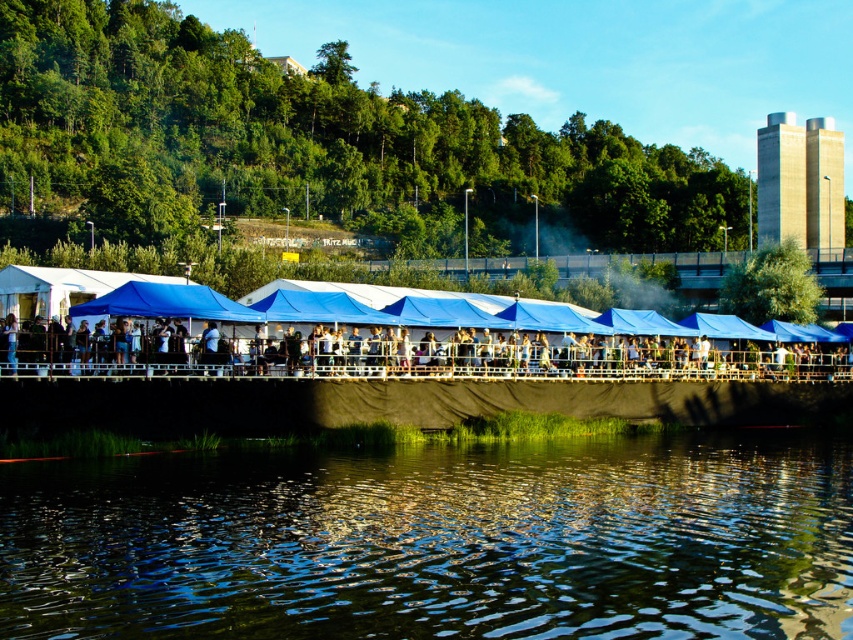
Can you confirm if green reflective water at lower center is shorter than blue fabric canopy at center?

Correct, green reflective water at lower center is not as tall as blue fabric canopy at center.

Who is shorter, green reflective water at lower center or blue fabric canopy at center?

Standing shorter between the two is green reflective water at lower center.

Does point (142, 556) come behind point (198, 307)?

No.

Where is `green reflective water at lower center`? green reflective water at lower center is located at coordinates (438, 540).

Where is `green reflective water at lower center`? The width and height of the screenshot is (853, 640). green reflective water at lower center is located at coordinates (438, 540).

Find the location of `green reflective water at lower center`. green reflective water at lower center is located at coordinates (438, 540).

Locate an element on the screen. green reflective water at lower center is located at coordinates (438, 540).

Is point (122, 326) farther from camera compared to point (141, 282)?

No, it is not.

The width and height of the screenshot is (853, 640). I want to click on white fabric tent at center, so click(402, 352).